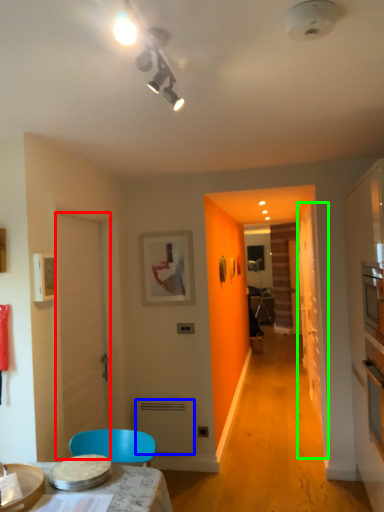
Question: Considering the real-world distances, which object is closest to door (highlighted by a red box)? appliance (highlighted by a blue box) or glass door (highlighted by a green box).

Choices:
 (A) appliance
 (B) glass door

Answer: (A)